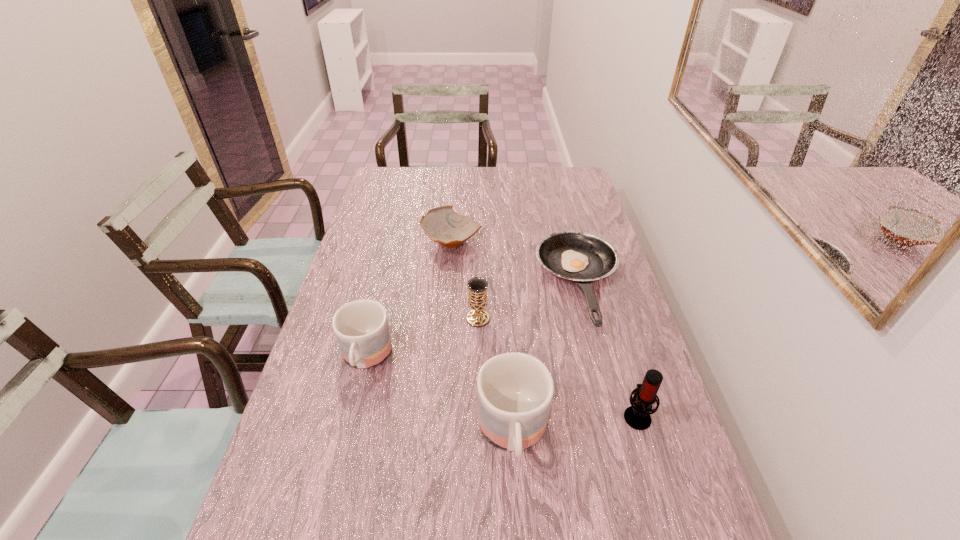
This screenshot has height=540, width=960. What are the coordinates of `object that can be found as the fifth closest to the shortest object` in the screenshot? It's located at (361, 327).

Find the location of a particular element. This screenshot has height=540, width=960. object that can be found as the closest to the microphone is located at coordinates (515, 390).

At what (x,y) coordinates should I click in order to perform the action: click on blank space that satisfies the following two spatial constraints: 1. on the side with the handle of the left mug; 2. on the left side of the microphone. Please return your answer as a coordinate pair (x, y). Image resolution: width=960 pixels, height=540 pixels. Looking at the image, I should click on (351, 416).

Identify the location of vacant area that satisfies the following two spatial constraints: 1. on the back side of the frying pan; 2. on the left side of the chalice. Image resolution: width=960 pixels, height=540 pixels. (478, 283).